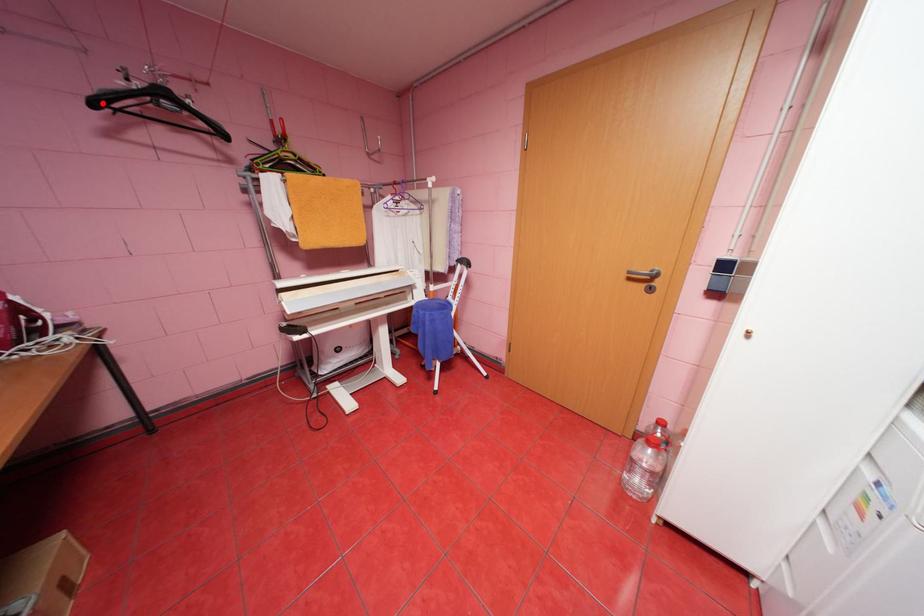
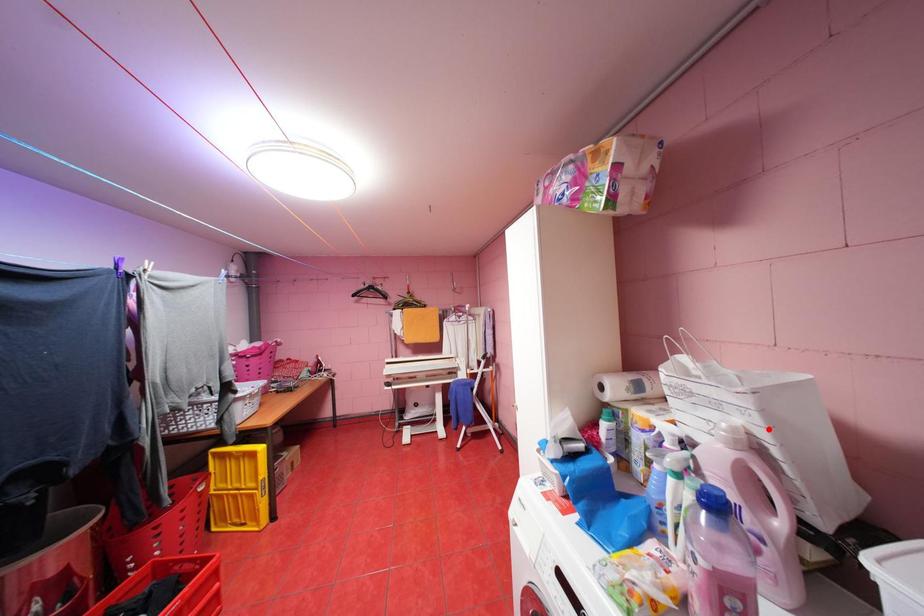
I am providing you with two images of the same scene from different viewpoints. A red point is marked on the first image and another point is marked on the second image. Is the red point in image1 aligned with the point shown in image2?

No